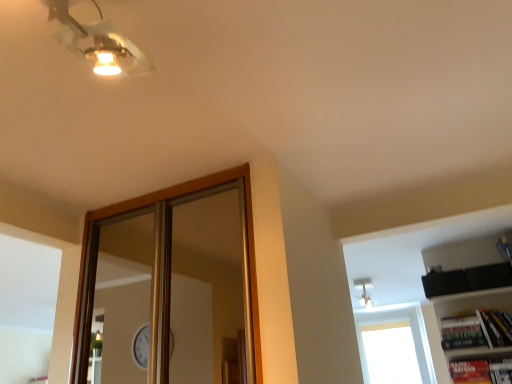
This screenshot has width=512, height=384. What are the coordinates of `white glass window at upper right` in the screenshot? It's located at click(x=412, y=335).

What do you see at coordinates (412, 335) in the screenshot? I see `white glass window at upper right` at bounding box center [412, 335].

Describe the element at coordinates (99, 42) in the screenshot. The image size is (512, 384). I see `metallic gold ceiling light at upper left` at that location.

Identify the location of metallic gold ceiling light at upper left. This screenshot has height=384, width=512. pyautogui.click(x=99, y=42).

This screenshot has width=512, height=384. I want to click on white glass window at upper right, so click(x=412, y=335).

Which object is positioned more to the right, metallic gold ceiling light at upper left or white glass window at upper right?

white glass window at upper right is more to the right.

In the scene shown: Is metallic gold ceiling light at upper left in front of or behind white glass window at upper right in the image?

metallic gold ceiling light at upper left is in front of white glass window at upper right.

Is point (62, 8) closer to camera compared to point (422, 332)?

That is True.

From the image's perspective, which is above, metallic gold ceiling light at upper left or white glass window at upper right?

metallic gold ceiling light at upper left, from the image's perspective.

From a real-world perspective, is metallic gold ceiling light at upper left located higher than white glass window at upper right?

Yes, from a real-world perspective, metallic gold ceiling light at upper left is over white glass window at upper right

Which object is wider, metallic gold ceiling light at upper left or white glass window at upper right?

white glass window at upper right.

Can you confirm if metallic gold ceiling light at upper left is taller than white glass window at upper right?

No, metallic gold ceiling light at upper left is not taller than white glass window at upper right.

Between metallic gold ceiling light at upper left and white glass window at upper right, which one has smaller size?

metallic gold ceiling light at upper left is smaller.

From the picture: Do you think metallic gold ceiling light at upper left is within white glass window at upper right, or outside of it?

metallic gold ceiling light at upper left is not enclosed by white glass window at upper right.

Are metallic gold ceiling light at upper left and white glass window at upper right far apart?

Yes.

Looking at this image, is white glass window at upper right at the back of metallic gold ceiling light at upper left?

That's not correct — metallic gold ceiling light at upper left is not looking away from white glass window at upper right.

How different are the orientations of metallic gold ceiling light at upper left and white glass window at upper right in degrees?

The angular difference between metallic gold ceiling light at upper left and white glass window at upper right is 87.4 degrees.

The image size is (512, 384). What are the coordinates of `window located underneath the metallic gold ceiling light at upper left (from a real-world perspective)` in the screenshot? It's located at click(x=412, y=335).

Does white glass window at upper right appear on the left side of metallic gold ceiling light at upper left?

No.

Is the depth of white glass window at upper right greater than that of metallic gold ceiling light at upper left?

Yes, white glass window at upper right is further from the camera.

Which is further, (390, 315) or (104, 45)?

The point (390, 315) is behind.

From the image's perspective, is white glass window at upper right located beneath metallic gold ceiling light at upper left?

Yes, from the image's perspective, white glass window at upper right is below metallic gold ceiling light at upper left.

From a real-world perspective, is white glass window at upper right physically below metallic gold ceiling light at upper left?

Yes, from a real-world perspective, white glass window at upper right is beneath metallic gold ceiling light at upper left.

Is white glass window at upper right wider or thinner than metallic gold ceiling light at upper left?

In the image, white glass window at upper right appears to be wider than metallic gold ceiling light at upper left.

Who is taller, white glass window at upper right or metallic gold ceiling light at upper left?

With more height is white glass window at upper right.

Considering the relative sizes of white glass window at upper right and metallic gold ceiling light at upper left in the image provided, is white glass window at upper right bigger than metallic gold ceiling light at upper left?

Indeed, white glass window at upper right has a larger size compared to metallic gold ceiling light at upper left.

Is white glass window at upper right situated inside metallic gold ceiling light at upper left or outside?

white glass window at upper right cannot be found inside metallic gold ceiling light at upper left.

Is white glass window at upper right beside metallic gold ceiling light at upper left?

No, white glass window at upper right is not next to metallic gold ceiling light at upper left.

Could you tell me if white glass window at upper right is facing metallic gold ceiling light at upper left?

Yes, white glass window at upper right is aimed at metallic gold ceiling light at upper left.

How many degrees apart are the facing directions of white glass window at upper right and metallic gold ceiling light at upper left?

87.4 degrees separate the facing orientations of white glass window at upper right and metallic gold ceiling light at upper left.

This screenshot has width=512, height=384. Identify the location of fan on the left of white glass window at upper right. (99, 42).

The height and width of the screenshot is (384, 512). In order to click on fan on the left of white glass window at upper right in this screenshot , I will do `click(99, 42)`.

Identify the location of window that appears on the right of metallic gold ceiling light at upper left. (412, 335).